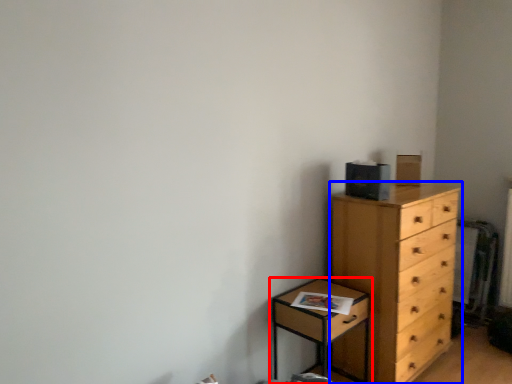
Question: Which object appears closest to the camera in this image, nightstand (highlighted by a red box) or chest of drawers (highlighted by a blue box)?

Choices:
 (A) nightstand
 (B) chest of drawers

Answer: (A)